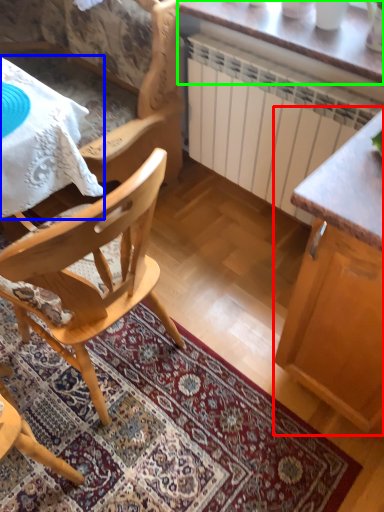
Question: Which is farther away from cabinetry (highlighted by a red box)? desk (highlighted by a blue box) or table (highlighted by a green box)?

Choices:
 (A) desk
 (B) table

Answer: (A)